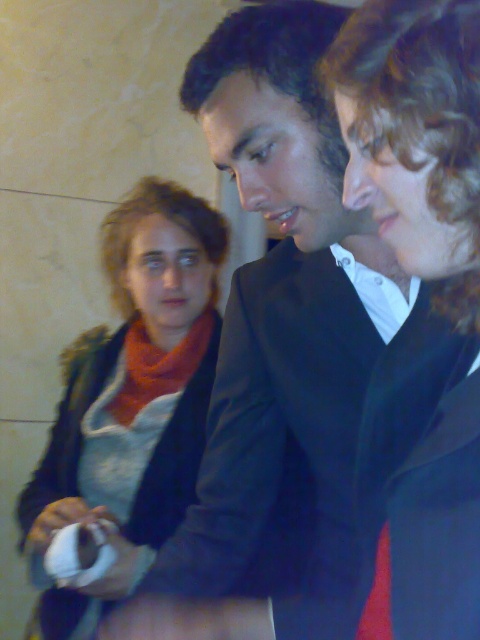
You are standing in the room and need to locate the matte black jacket at center. According to the coordinates given, where exactly should you look to find it?

The matte black jacket at center is located at point 0.212 on the horizontal axis and 0.867 on the vertical axis, so you should look towards the lower left area of the image since lower values on the vertical axis mean it is closer to the bottom and lower horizontal values mean it is closer to the left side.

You are a photographer setting up a camera to capture the scene described. You need to ensure that both the matte black jacket at center and the matte orange scarf at upper left are in focus simultaneously. Given their current positions, what is the minimum distance your camera should be set to achieve this?

The matte black jacket at center and matte orange scarf at upper left are 35.58 inches apart. To ensure both are in focus, the camera should be set to a distance that covers this separation, typically requiring a focus point midway between them or using a smaller aperture for greater depth of field.

You are standing in the room where the two men are. You want to take a photo of the point at coordinates point (x=414, y=16). What is the minimum distance you need to move forward or backward to ensure the point is in focus?

The point at coordinates point (x=414, y=16) is 18.44 inches from the camera. To ensure it is in focus, you should position yourself so that the camera is exactly 18.44 inches away from the point.